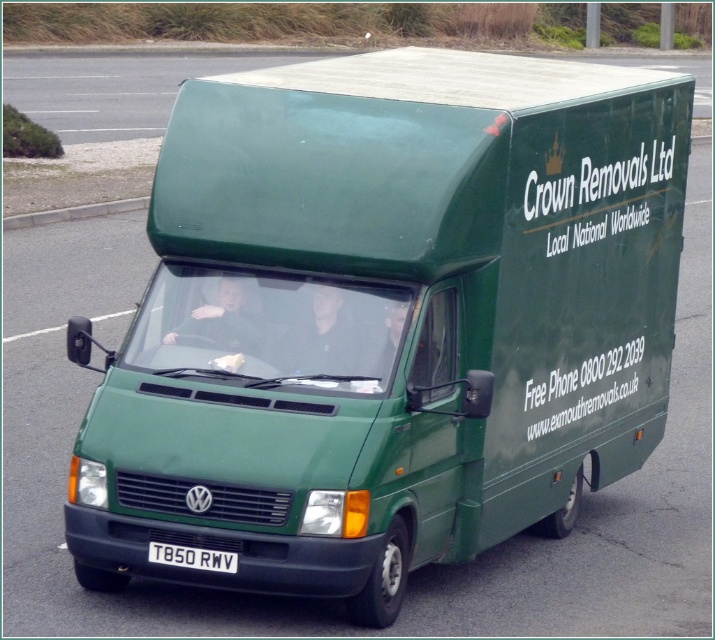
You are a delivery driver who needs to park your van on the paved area. The gray concrete curb at left and the white plastic license plate at center are both in your path. Which object should you avoid hitting to ensure safe parking?

You should avoid hitting the gray concrete curb at left because it is larger in size than the white plastic license plate at center, making it more dangerous to collide with.

You are a delivery driver who needs to park the Crown Removals Ltd van on the paved area. The van is 7 meters long. There is a gray concrete curb at left marked by point [73,212]. Is there enough space to park the van without crossing the curb?

→ The gray concrete curb at left is represented by point [73,212]. The van is 7 meters long. However, the scene does not provide specific measurements of the paved area or distance from the curb to determine if there is sufficient space. Without this information, it is impossible to confirm if parking the van without crossing the curb is feasible.